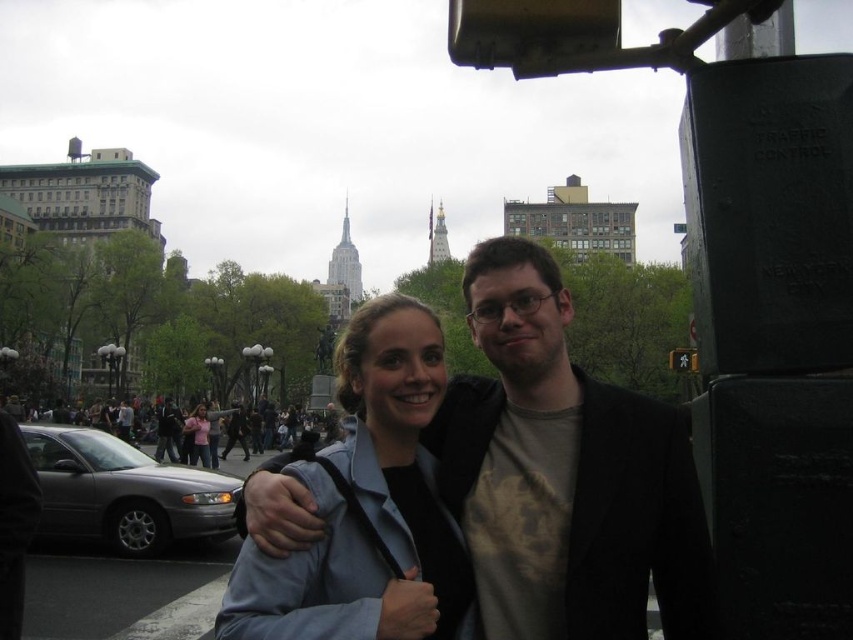
Which is more to the right, matte black jacket at center or pink fabric shirt at center?

Positioned to the right is matte black jacket at center.

Who is lower down, matte black jacket at center or pink fabric shirt at center?

pink fabric shirt at center

Who is more forward, (500,465) or (192,458)?

Point (500,465)

This screenshot has height=640, width=853. I want to click on matte black jacket at center, so click(566, 474).

Who is more forward, (546, 602) or (405, 472)?

Point (546, 602)

Which is more to the left, matte black jacket at center or light blue denim jacket at center?

light blue denim jacket at center is more to the left.

Is point (547, 504) closer to viewer compared to point (271, 630)?

No, (547, 504) is further to viewer.

Where is `matte black jacket at center`? The width and height of the screenshot is (853, 640). matte black jacket at center is located at coordinates (566, 474).

Is light blue denim jacket at center to the left of pink fabric shirt at center from the viewer's perspective?

No, light blue denim jacket at center is not to the left of pink fabric shirt at center.

What do you see at coordinates (368, 506) in the screenshot? This screenshot has width=853, height=640. I see `light blue denim jacket at center` at bounding box center [368, 506].

Does point (346, 355) come in front of point (202, 452)?

That is True.

The width and height of the screenshot is (853, 640). Identify the location of light blue denim jacket at center. (368, 506).